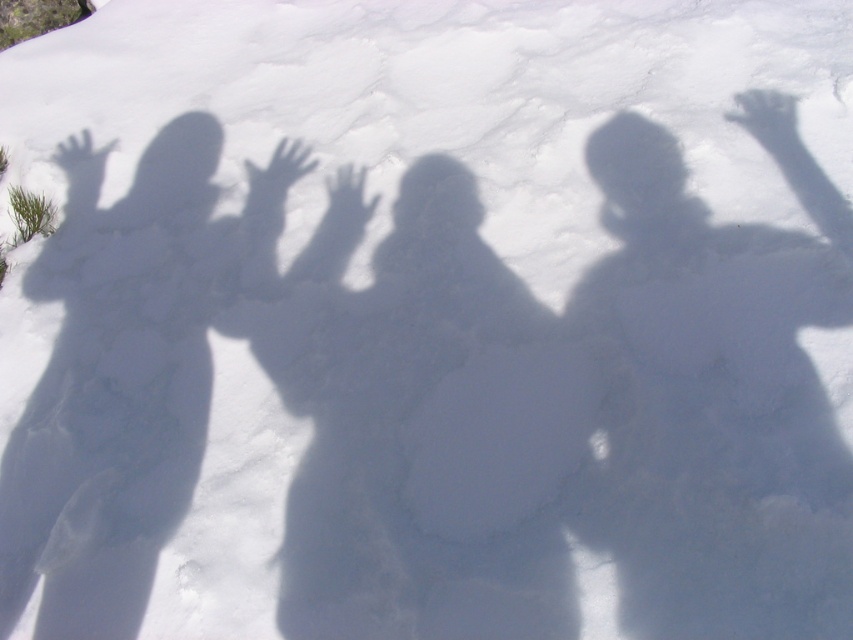
You are standing in front of the four shadows on the snowy ground. You see two points labeled as point 1 and point 2. Point 1 is at position [305,308] and point 2 is at [61,401]. Which point is closer to you?

Point 2 at [61,401] is closer to you because it is positioned closer to the camera compared to point 1 at [305,308].

Looking at this image, based on the scene description and the shadows provided, which shadow is positioned exactly at the coordinates point (x=718, y=392)?

The smooth shadow figure at center is located at point (x=718, y=392).

Based on the scene description, which shadow figure is wider, the dark shadow figure at center or the smooth shadow figure at left?

The dark shadow figure at center is wider than the smooth shadow figure at left according to the description.